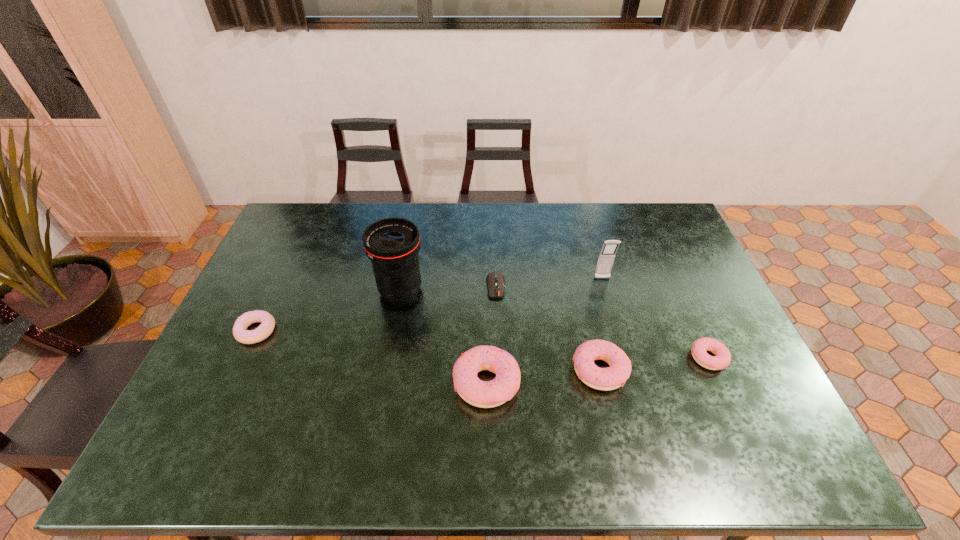
Where is `vacant area that lies between the leftmost doughnut and the cellular telephone`? Image resolution: width=960 pixels, height=540 pixels. vacant area that lies between the leftmost doughnut and the cellular telephone is located at coordinates (429, 305).

I want to click on vacant area that lies between the rightmost object and the second tallest object, so click(655, 319).

In order to click on blank region between the fourth tallest object and the shortest doughnut in this screenshot , I will do `click(655, 364)`.

Image resolution: width=960 pixels, height=540 pixels. Find the location of `vacant area that lies between the leftmost object and the shortest doughnut`. vacant area that lies between the leftmost object and the shortest doughnut is located at coordinates (482, 345).

You are a GUI agent. You are given a task and a screenshot of the screen. Output one action in this format:
    pyautogui.click(x=<x>, y=<y>)
    Task: Click on the object that is the third closest to the shortest doughnut
    Image resolution: width=960 pixels, height=540 pixels.
    Given the screenshot: What is the action you would take?
    pyautogui.click(x=485, y=394)

The image size is (960, 540). In order to click on object that is the nearest to the second doughnut from left to right in this screenshot , I will do `click(610, 378)`.

Locate an element on the screen. The height and width of the screenshot is (540, 960). doughnut that is the third nearest to the cellular telephone is located at coordinates (485, 394).

Identify which doughnut is the closest to the cellular telephone. Please provide its 2D coordinates. Your answer should be formatted as a tuple, i.e. [(x, y)], where the tuple contains the x and y coordinates of a point satisfying the conditions above.

[(610, 378)]

Locate an element on the screen. This screenshot has height=540, width=960. vacant space that satisfies the following two spatial constraints: 1. on the front-facing side of the sixth shortest object; 2. on the right side of the rightmost object is located at coordinates (625, 358).

The image size is (960, 540). Identify the location of free space that satisfies the following two spatial constraints: 1. on the front side of the third shortest doughnut; 2. on the right side of the tallest object. (386, 370).